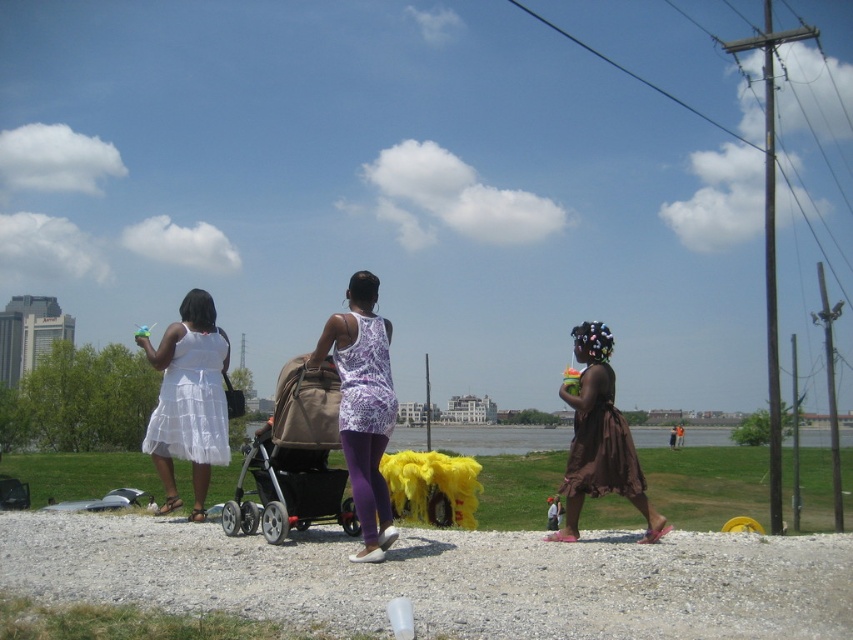
You are a photographer trying to capture a group photo of the purple printed tank top at center and the brown satin dress at lower right. Since you want both subjects to appear the same size in the photo, where should you position yourself relative to them?

To make the purple printed tank top at center and the brown satin dress at lower right appear the same size in the photo, you should position yourself closer to the brown satin dress at lower right because it is larger and moving closer to it will reduce its apparent size, balancing it with the smaller purple printed tank top at center.

You are a fashion designer observing the two purple garments in the scene. Which one is taller in height between the purple printed tank top at center and the purple printed dress at center?

The purple printed tank top at center has a greater height compared to the purple printed dress at center.